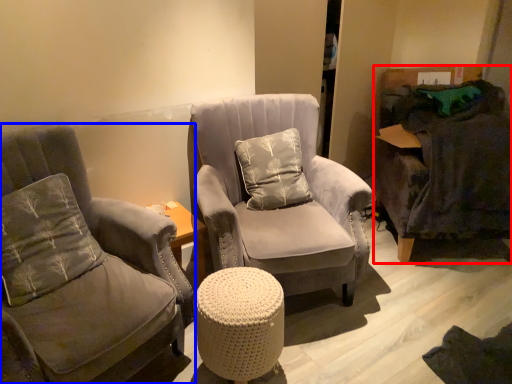
Question: Among these objects, which one is farthest to the camera, swivel chair (highlighted by a red box) or chair (highlighted by a blue box)?

Choices:
 (A) swivel chair
 (B) chair

Answer: (A)